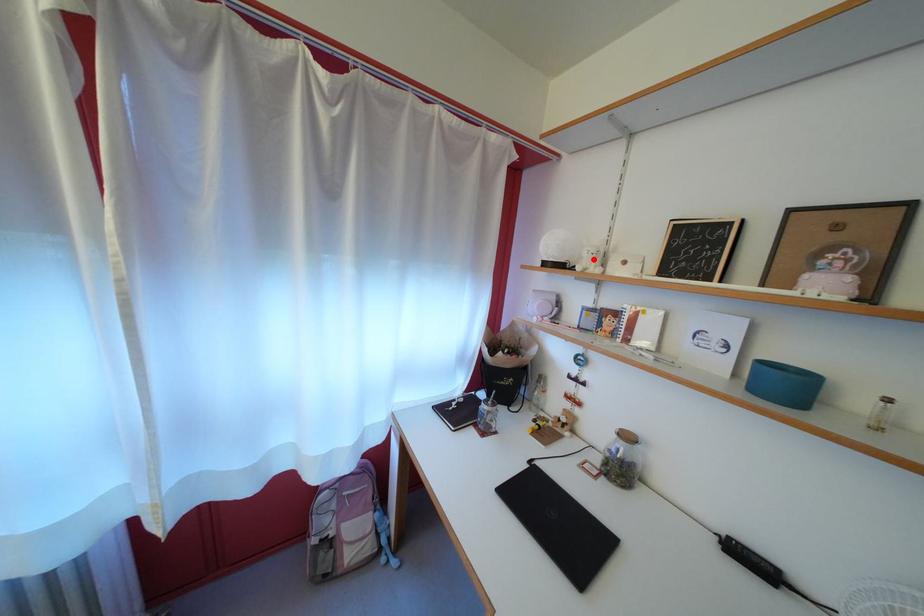
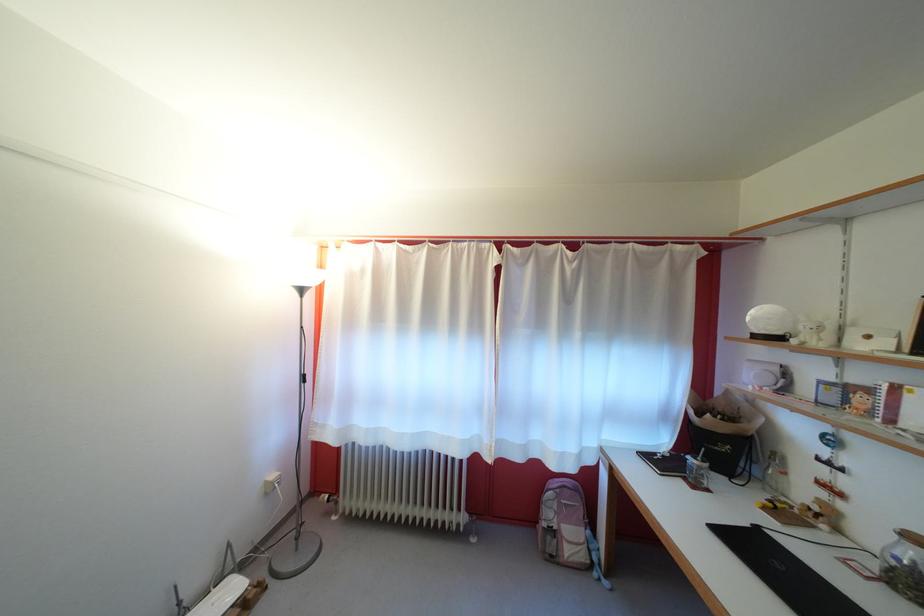
Locate, in the second image, the point that corresponds to the highlighted location in the first image.

(809, 334)